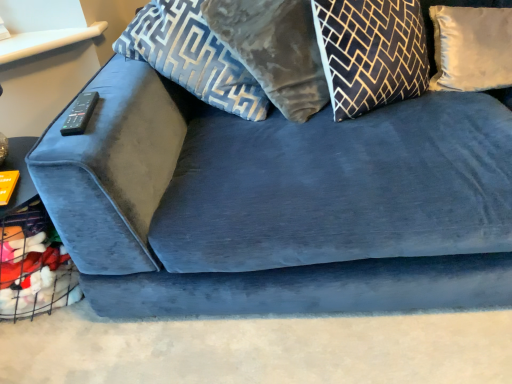
This screenshot has width=512, height=384. Describe the element at coordinates (371, 52) in the screenshot. I see `black and gold geometric pillow at upper center, which appears as the third pillow when viewed from the left` at that location.

This screenshot has width=512, height=384. Describe the element at coordinates (192, 57) in the screenshot. I see `velvet blue pillow at upper center, which ranks as the first pillow in left-to-right order` at that location.

Locate an element on the screen. This screenshot has width=512, height=384. velvet gray pillow at upper center, placed as the second pillow when sorted from left to right is located at coordinates (274, 50).

You are a GUI agent. You are given a task and a screenshot of the screen. Output one action in this format:
    pyautogui.click(x=<x>, y=<y>)
    Task: Click on the black plastic remote at upper left
    The image size is (512, 384).
    Given the screenshot: What is the action you would take?
    pyautogui.click(x=80, y=114)

This screenshot has width=512, height=384. Identify the location of white satin pillow at upper right, placed as the fourth pillow when sorted from left to right. (471, 48).

Image resolution: width=512 pixels, height=384 pixels. What are the coordinates of `black and gold geometric pillow at upper center, which appears as the third pillow when viewed from the left` in the screenshot? It's located at (371, 52).

From a real-world perspective, is black and gold geometric pillow at upper center, which appears as the third pillow when viewed from the left, physically below velvet gray pillow at upper center, placed as the second pillow when sorted from left to right?

Indeed, from a real-world perspective, black and gold geometric pillow at upper center, which appears as the third pillow when viewed from the left, is positioned beneath velvet gray pillow at upper center, placed as the second pillow when sorted from left to right.

Can velvet gray pillow at upper center, which appears as the 3th pillow when viewed from the right, be found inside black and gold geometric pillow at upper center, which appears as the third pillow when viewed from the left?

Definitely not — velvet gray pillow at upper center, which appears as the 3th pillow when viewed from the right, is not inside black and gold geometric pillow at upper center, which appears as the third pillow when viewed from the left.

Are black and gold geometric pillow at upper center, which is the second pillow in right-to-left order, and velvet gray pillow at upper center, placed as the second pillow when sorted from left to right, beside each other?

There is a gap between black and gold geometric pillow at upper center, which is the second pillow in right-to-left order, and velvet gray pillow at upper center, placed as the second pillow when sorted from left to right.

Based on the photo, would you say black and gold geometric pillow at upper center, which appears as the third pillow when viewed from the left, is to the left or to the right of velvet gray pillow at upper center, which appears as the 3th pillow when viewed from the right, in the picture?

Clearly, black and gold geometric pillow at upper center, which appears as the third pillow when viewed from the left, is on the right of velvet gray pillow at upper center, which appears as the 3th pillow when viewed from the right, in the image.

Visually, is black plastic remote at upper left positioned to the left or to the right of white satin pillow at upper right, which is the first pillow in right-to-left order?

Clearly, black plastic remote at upper left is on the left of white satin pillow at upper right, which is the first pillow in right-to-left order, in the image.

From the image's perspective, is black plastic remote at upper left located beneath white satin pillow at upper right, placed as the fourth pillow when sorted from left to right?

Yes, from the image's perspective, black plastic remote at upper left is below white satin pillow at upper right, placed as the fourth pillow when sorted from left to right.

Does point (79, 107) come in front of point (493, 46)?

Yes, it is.

Where is `remote that appears below the white satin pillow at upper right, which is the first pillow in right-to-left order (from the image's perspective)`? This screenshot has height=384, width=512. remote that appears below the white satin pillow at upper right, which is the first pillow in right-to-left order (from the image's perspective) is located at coordinates (80, 114).

From the picture: From a real-world perspective, which object rests below the other?

In real-world perspective, white satin pillow at upper right, placed as the fourth pillow when sorted from left to right, is lower.

Which object is closer to the camera taking this photo, velvet gray pillow at upper center, placed as the second pillow when sorted from left to right, or white satin pillow at upper right, which is the first pillow in right-to-left order?

velvet gray pillow at upper center, placed as the second pillow when sorted from left to right.

Considering the sizes of objects velvet gray pillow at upper center, which appears as the 3th pillow when viewed from the right, and white satin pillow at upper right, placed as the fourth pillow when sorted from left to right, in the image provided, who is bigger, velvet gray pillow at upper center, which appears as the 3th pillow when viewed from the right, or white satin pillow at upper right, placed as the fourth pillow when sorted from left to right,?

Bigger between the two is velvet gray pillow at upper center, which appears as the 3th pillow when viewed from the right.

Is point (484, 43) more distant than point (407, 93)?

That is True.

Does white satin pillow at upper right, which is the first pillow in right-to-left order, lie in front of black and gold geometric pillow at upper center, which appears as the third pillow when viewed from the left?

No, white satin pillow at upper right, which is the first pillow in right-to-left order, is further to the viewer.

Between white satin pillow at upper right, which is the first pillow in right-to-left order, and black and gold geometric pillow at upper center, which appears as the third pillow when viewed from the left, which one appears on the right side from the viewer's perspective?

white satin pillow at upper right, which is the first pillow in right-to-left order, is more to the right.

Is velvet blue pillow at upper center, which ranks as the first pillow in left-to-right order, surrounded by black and gold geometric pillow at upper center, which is the second pillow in right-to-left order?

No, velvet blue pillow at upper center, which ranks as the first pillow in left-to-right order, is located outside of black and gold geometric pillow at upper center, which is the second pillow in right-to-left order.

Considering the relative sizes of black and gold geometric pillow at upper center, which appears as the third pillow when viewed from the left, and velvet blue pillow at upper center, which ranks as the first pillow in left-to-right order, in the image provided, is black and gold geometric pillow at upper center, which appears as the third pillow when viewed from the left, taller than velvet blue pillow at upper center, which ranks as the first pillow in left-to-right order,?

No, black and gold geometric pillow at upper center, which appears as the third pillow when viewed from the left, is not taller than velvet blue pillow at upper center, which ranks as the first pillow in left-to-right order.

Identify the location of pillow lying below the white satin pillow at upper right, which is the first pillow in right-to-left order (from the image's perspective). (371, 52).

Considering the relative positions of black and gold geometric pillow at upper center, which appears as the third pillow when viewed from the left, and white satin pillow at upper right, which is the first pillow in right-to-left order, in the image provided, is black and gold geometric pillow at upper center, which appears as the third pillow when viewed from the left, to the right of white satin pillow at upper right, which is the first pillow in right-to-left order, from the viewer's perspective?

In fact, black and gold geometric pillow at upper center, which appears as the third pillow when viewed from the left, is to the left of white satin pillow at upper right, which is the first pillow in right-to-left order.

Can you tell me how much black and gold geometric pillow at upper center, which appears as the third pillow when viewed from the left, and white satin pillow at upper right, placed as the fourth pillow when sorted from left to right, differ in facing direction?

The facing directions of black and gold geometric pillow at upper center, which appears as the third pillow when viewed from the left, and white satin pillow at upper right, placed as the fourth pillow when sorted from left to right, are 0.0105 degrees apart.

Can you tell me how much velvet gray pillow at upper center, which appears as the 3th pillow when viewed from the right, and black and gold geometric pillow at upper center, which is the second pillow in right-to-left order, differ in facing direction?

There is a 0.000914-degree angle between the facing directions of velvet gray pillow at upper center, which appears as the 3th pillow when viewed from the right, and black and gold geometric pillow at upper center, which is the second pillow in right-to-left order.

Considering the sizes of velvet gray pillow at upper center, placed as the second pillow when sorted from left to right, and black and gold geometric pillow at upper center, which appears as the third pillow when viewed from the left, in the image, is velvet gray pillow at upper center, placed as the second pillow when sorted from left to right, taller or shorter than black and gold geometric pillow at upper center, which appears as the third pillow when viewed from the left,?

Clearly, velvet gray pillow at upper center, placed as the second pillow when sorted from left to right, is taller compared to black and gold geometric pillow at upper center, which appears as the third pillow when viewed from the left.

Does velvet gray pillow at upper center, which appears as the 3th pillow when viewed from the right, turn towards black and gold geometric pillow at upper center, which appears as the third pillow when viewed from the left?

No, velvet gray pillow at upper center, which appears as the 3th pillow when viewed from the right, is not facing towards black and gold geometric pillow at upper center, which appears as the third pillow when viewed from the left.

Is velvet gray pillow at upper center, which appears as the 3th pillow when viewed from the right, inside the boundaries of black and gold geometric pillow at upper center, which is the second pillow in right-to-left order, or outside?

velvet gray pillow at upper center, which appears as the 3th pillow when viewed from the right, cannot be found inside black and gold geometric pillow at upper center, which is the second pillow in right-to-left order.

Locate an element on the screen. pillow in front of the velvet gray pillow at upper center, which appears as the 3th pillow when viewed from the right is located at coordinates (371, 52).

In order to click on remote on the left side of white satin pillow at upper right, which is the first pillow in right-to-left order in this screenshot , I will do `click(80, 114)`.

Estimate the real-world distances between objects in this image. Which object is closer to velvet gray pillow at upper center, placed as the second pillow when sorted from left to right, white satin pillow at upper right, which is the first pillow in right-to-left order, or black plastic remote at upper left?

Among the two, black plastic remote at upper left is located nearer to velvet gray pillow at upper center, placed as the second pillow when sorted from left to right.

When comparing their distances from velvet blue pillow at upper center, which ranks as the first pillow in left-to-right order, does black and gold geometric pillow at upper center, which is the second pillow in right-to-left order, or velvet gray pillow at upper center, placed as the second pillow when sorted from left to right, seem further?

black and gold geometric pillow at upper center, which is the second pillow in right-to-left order, is further to velvet blue pillow at upper center, which ranks as the first pillow in left-to-right order.

When comparing their distances from velvet gray pillow at upper center, which appears as the 3th pillow when viewed from the right, does white satin pillow at upper right, which is the first pillow in right-to-left order, or black and gold geometric pillow at upper center, which is the second pillow in right-to-left order, seem further?

Among the two, white satin pillow at upper right, which is the first pillow in right-to-left order, is located further to velvet gray pillow at upper center, which appears as the 3th pillow when viewed from the right.

Considering their positions, is velvet blue pillow at upper center, acting as the fourth pillow starting from the right, positioned closer to black and gold geometric pillow at upper center, which appears as the third pillow when viewed from the left, than black plastic remote at upper left?

Among the two, velvet blue pillow at upper center, acting as the fourth pillow starting from the right, is located nearer to black and gold geometric pillow at upper center, which appears as the third pillow when viewed from the left.

Which object lies nearer to the anchor point white satin pillow at upper right, which is the first pillow in right-to-left order, velvet gray pillow at upper center, which appears as the 3th pillow when viewed from the right, or black plastic remote at upper left?

velvet gray pillow at upper center, which appears as the 3th pillow when viewed from the right.

Consider the image. Looking at the image, which one is located closer to white satin pillow at upper right, placed as the fourth pillow when sorted from left to right, velvet blue pillow at upper center, acting as the fourth pillow starting from the right, or velvet gray pillow at upper center, which appears as the 3th pillow when viewed from the right?

velvet gray pillow at upper center, which appears as the 3th pillow when viewed from the right, is positioned closer to the anchor white satin pillow at upper right, placed as the fourth pillow when sorted from left to right.

Considering their positions, is black and gold geometric pillow at upper center, which appears as the third pillow when viewed from the left, positioned further to white satin pillow at upper right, placed as the fourth pillow when sorted from left to right, than velvet blue pillow at upper center, acting as the fourth pillow starting from the right?

velvet blue pillow at upper center, acting as the fourth pillow starting from the right, is positioned further to the anchor white satin pillow at upper right, placed as the fourth pillow when sorted from left to right.

When comparing their distances from black plastic remote at upper left, does white satin pillow at upper right, which is the first pillow in right-to-left order, or velvet gray pillow at upper center, placed as the second pillow when sorted from left to right, seem further?

white satin pillow at upper right, which is the first pillow in right-to-left order.

Locate an element on the screen. The height and width of the screenshot is (384, 512). pillow between velvet blue pillow at upper center, acting as the fourth pillow starting from the right, and black and gold geometric pillow at upper center, which appears as the third pillow when viewed from the left is located at coordinates (274, 50).

Locate an element on the screen. pillow between black plastic remote at upper left and velvet gray pillow at upper center, placed as the second pillow when sorted from left to right, in the horizontal direction is located at coordinates (192, 57).

Locate an element on the screen. pillow between velvet gray pillow at upper center, placed as the second pillow when sorted from left to right, and white satin pillow at upper right, which is the first pillow in right-to-left order, in the horizontal direction is located at coordinates (371, 52).